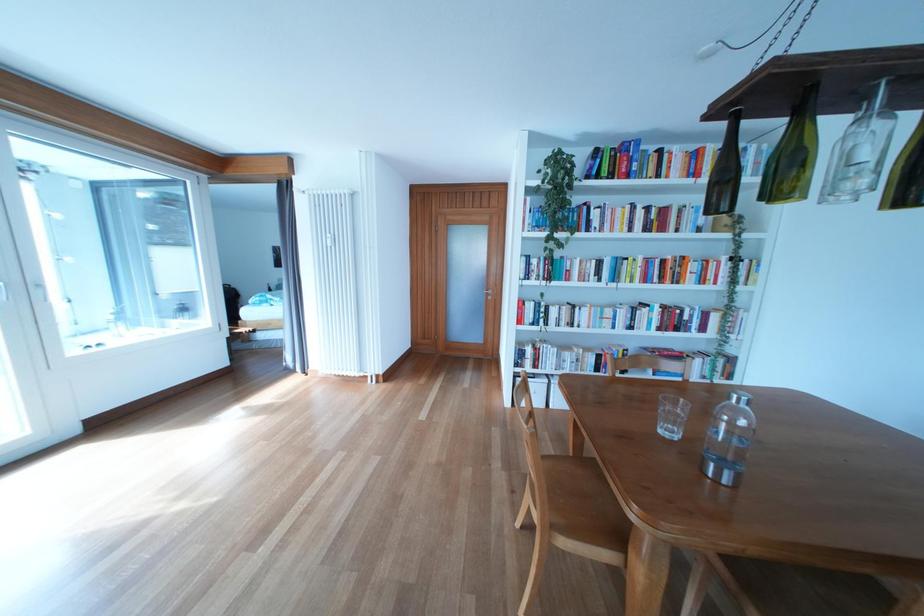
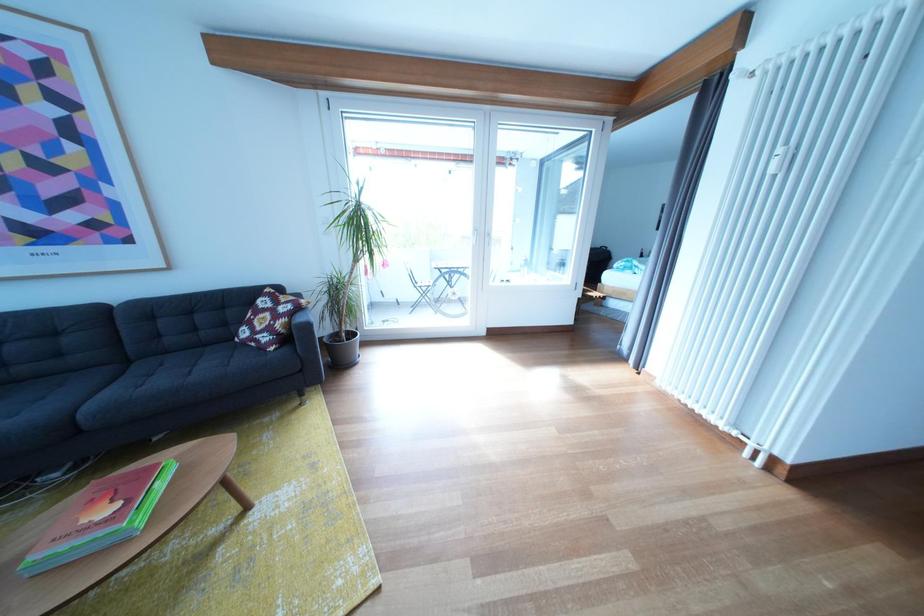
Locate, in the second image, the point that corresponds to the point at 342,241 in the first image.

(793, 156)